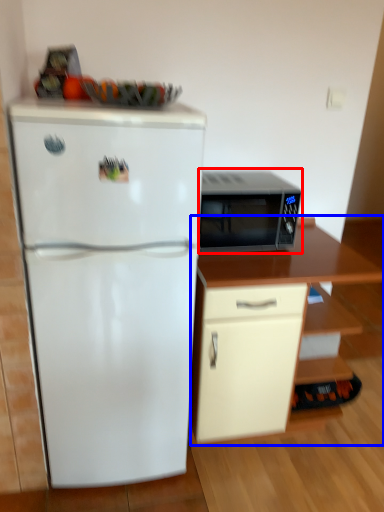
Question: Which point is further to the camera, microwave oven (highlighted by a red box) or cabinetry (highlighted by a blue box)?

Choices:
 (A) microwave oven
 (B) cabinetry

Answer: (A)